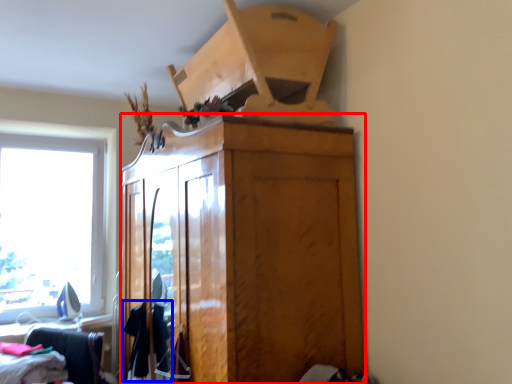
Question: Which object appears farthest to the camera in this image, cabinetry (highlighted by a red box) or clothing (highlighted by a blue box)?

Choices:
 (A) cabinetry
 (B) clothing

Answer: (B)